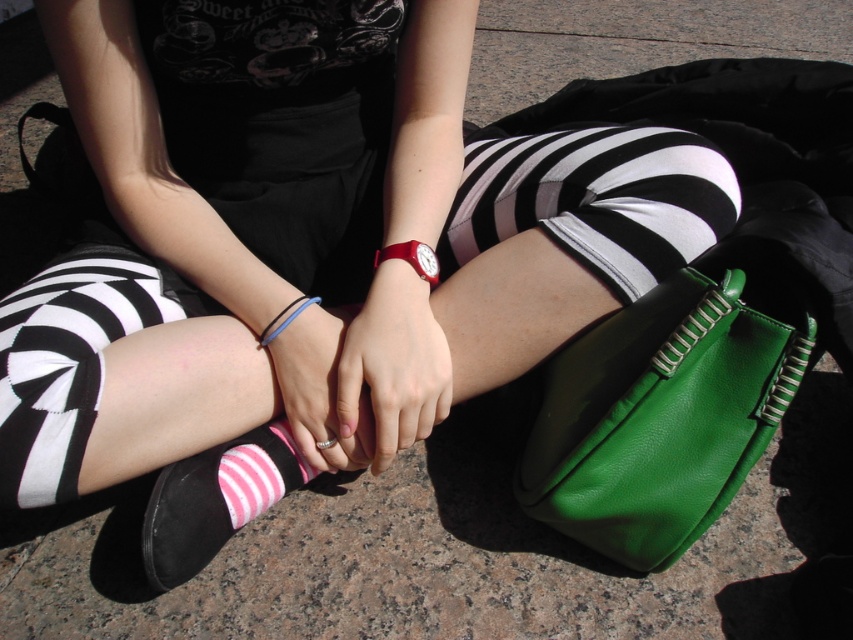
Question: Where is green leather handbag at lower right located in relation to black and white striped tights at center in the image?

Choices:
 (A) above
 (B) below

Answer: (B)

Question: Is the position of green leather handbag at lower right more distant than that of rubber band at center?

Choices:
 (A) yes
 (B) no

Answer: (B)

Question: Considering the real-world distances, which object is closest to the pink striped sock at lower center?

Choices:
 (A) black and white striped tights at center
 (B) rubber band at center
 (C) green leather handbag at lower right
 (D) black rubber bracelet at center

Answer: (D)

Question: Estimate the real-world distances between objects in this image. Which object is closer to the black rubber bracelet at center?

Choices:
 (A) rubber band at center
 (B) pink striped sock at lower center
 (C) black and white striped tights at center

Answer: (A)

Question: Is pink striped sock at lower center further to the viewer compared to black rubber bracelet at center?

Choices:
 (A) no
 (B) yes

Answer: (B)

Question: Which of the following is the farthest from the observer?

Choices:
 (A) (292, 440)
 (B) (651, 209)
 (C) (386, 253)

Answer: (A)